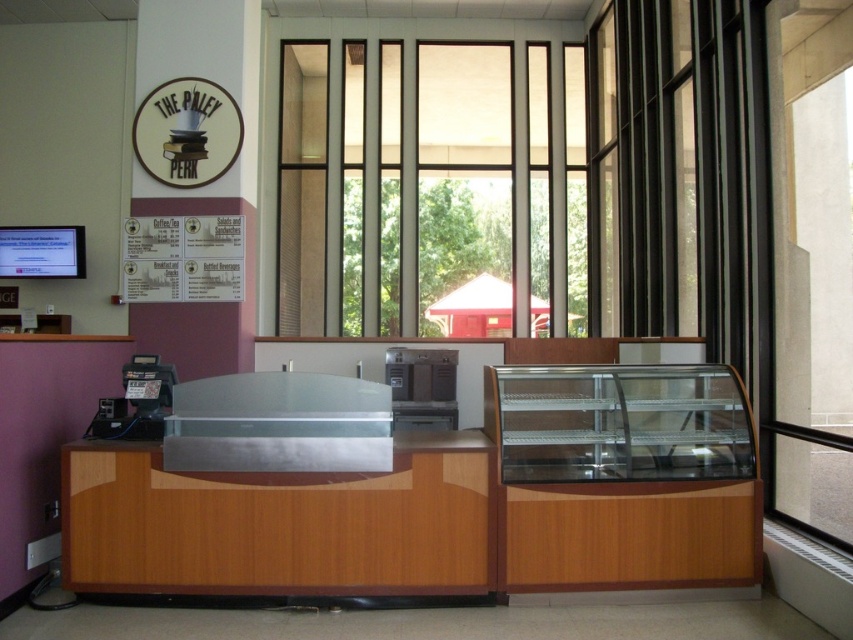
You are a customer in The Paley Perk and want to order a coffee. You need to approach the counter to place your order. Which object should you go to first, the transparent glass window at center or the wooden display case at right?

You should go to the transparent glass window at center first because it is likely the area where orders are taken, as the wooden display case at right is empty and positioned away from the cash register and menu board located on the left side of the counter.

You are a customer standing at the entrance of The Paley Perk. You notice the transparent glass window at center and the matte brown sign at upper center. Which object is closer to you?

The transparent glass window at center is closer to you because the matte brown sign at upper center is behind it.